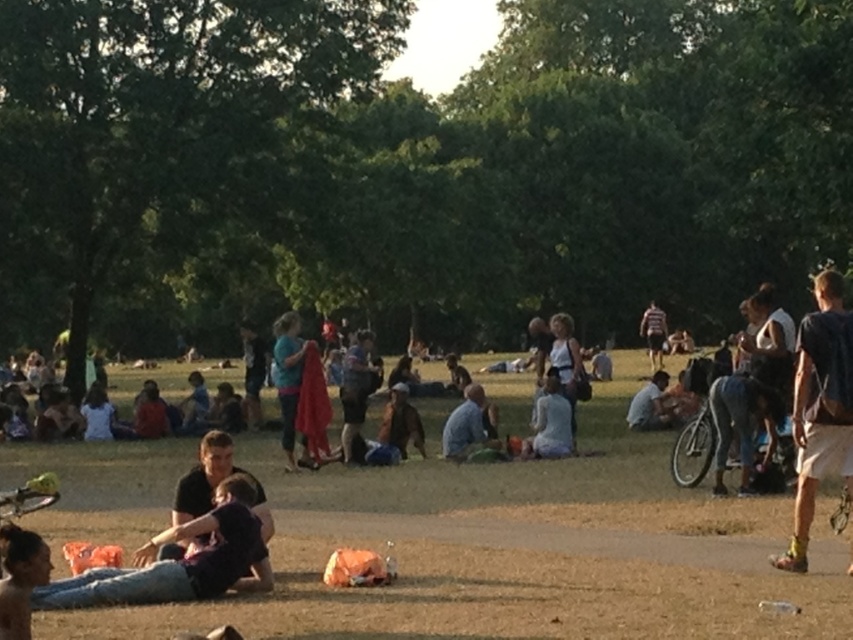
Question: Which point appears closest to the camera in this image?

Choices:
 (A) (827, 356)
 (B) (286, 385)

Answer: (A)

Question: Is the position of brown leather jacket at center more distant than that of striped shirt at center?

Choices:
 (A) yes
 (B) no

Answer: (B)

Question: Observing the image, what is the correct spatial positioning of blue fabric at center in reference to striped shirt at center?

Choices:
 (A) left
 (B) right

Answer: (A)

Question: Which object is the farthest from the striped shirt at center?

Choices:
 (A) blue fabric at center
 (B) dark blue shirt at lower left

Answer: (B)

Question: Can you confirm if dark blue denim shorts at right is positioned to the right of blue denim shirt at center?

Choices:
 (A) no
 (B) yes

Answer: (B)

Question: Which is nearer to the blue fabric at center?

Choices:
 (A) dark brown hair at lower left
 (B) light blue fabric at center

Answer: (B)